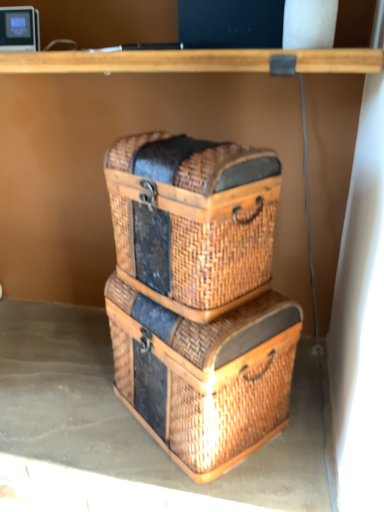
Question: From the image's perspective, is woven brown crate at center under woven brown basket at center?

Choices:
 (A) no
 (B) yes

Answer: (B)

Question: Are woven brown crate at center and woven brown basket at center far apart?

Choices:
 (A) no
 (B) yes

Answer: (A)

Question: Does woven brown crate at center come behind woven brown basket at center?

Choices:
 (A) no
 (B) yes

Answer: (B)

Question: Can you confirm if woven brown crate at center is wider than woven brown basket at center?

Choices:
 (A) yes
 (B) no

Answer: (A)

Question: Does woven brown crate at center have a larger size compared to woven brown basket at center?

Choices:
 (A) no
 (B) yes

Answer: (B)

Question: From the image's perspective, is woven brown crate at center on woven brown basket at center?

Choices:
 (A) no
 (B) yes

Answer: (A)

Question: From the image's perspective, is woven brown crate at center beneath woven brown basket at center?

Choices:
 (A) yes
 (B) no

Answer: (B)

Question: Is the depth of woven brown crate at center less than that of woven brown basket at center?

Choices:
 (A) no
 (B) yes

Answer: (B)

Question: Is woven brown basket at center inside woven brown crate at center?

Choices:
 (A) no
 (B) yes

Answer: (A)

Question: Is woven brown crate at center located outside woven brown basket at center?

Choices:
 (A) no
 (B) yes

Answer: (B)

Question: Is woven brown crate at center not near woven brown basket at center?

Choices:
 (A) yes
 (B) no

Answer: (B)

Question: Considering the relative positions of woven brown crate at center and woven brown basket at center in the image provided, is woven brown crate at center to the left of woven brown basket at center from the viewer's perspective?

Choices:
 (A) no
 (B) yes

Answer: (A)

Question: Considering the relative sizes of woven brown basket at center and woven brown crate at center in the image provided, is woven brown basket at center shorter than woven brown crate at center?

Choices:
 (A) yes
 (B) no

Answer: (A)